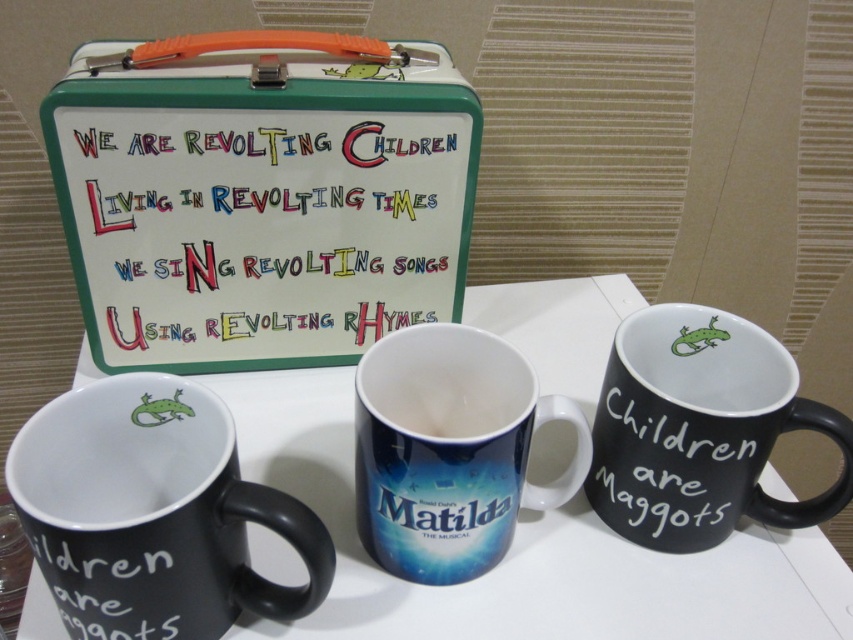
Which is in front, point (157, 538) or point (502, 374)?

Positioned in front is point (157, 538).

Which of these two, black chalkboard mug at lower left or matte ceramic mug at center, stands taller?

With more height is matte ceramic mug at center.

What do you see at coordinates (154, 513) in the screenshot?
I see `black chalkboard mug at lower left` at bounding box center [154, 513].

The width and height of the screenshot is (853, 640). I want to click on black chalkboard mug at lower left, so click(x=154, y=513).

Is point (74, 413) in front of point (610, 410)?

Yes, point (74, 413) is closer to viewer.

Is point (74, 554) positioned before point (674, 547)?

Yes, point (74, 554) is closer to viewer.

This screenshot has width=853, height=640. Identify the location of black chalkboard mug at lower left. (154, 513).

Is metallic green lunch box at upper center further to the viewer compared to matte ceramic mug at center?

Yes.

Does metallic green lunch box at upper center appear under matte ceramic mug at center?

No.

Describe the element at coordinates (260, 195) in the screenshot. This screenshot has height=640, width=853. I see `metallic green lunch box at upper center` at that location.

Where is `metallic green lunch box at upper center`? metallic green lunch box at upper center is located at coordinates (x=260, y=195).